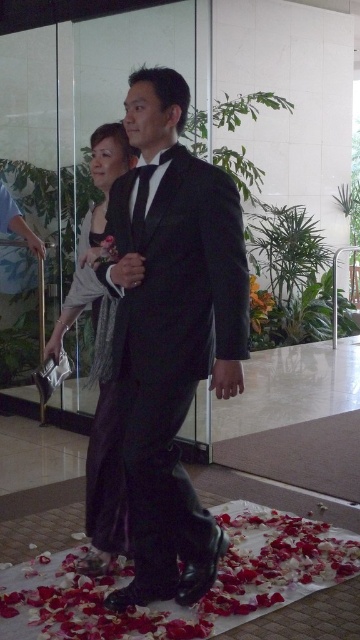
Question: Which is farther from the satin silver dress at center?

Choices:
 (A) satin black dress at center
 (B) black satin suit at center

Answer: (B)

Question: Observing the image, what is the correct spatial positioning of black satin suit at center in reference to orange matte flower at center?

Choices:
 (A) above
 (B) below

Answer: (B)

Question: Which object appears closest to the camera in this image?

Choices:
 (A) satin black dress at center
 (B) orange matte flower at center
 (C) black satin suit at center

Answer: (C)

Question: Which of these objects is positioned farthest from the black satin suit at center?

Choices:
 (A) orange matte flower at center
 (B) satin silver dress at center

Answer: (A)

Question: Can you confirm if black satin suit at center is wider than orange matte flower at center?

Choices:
 (A) yes
 (B) no

Answer: (A)

Question: Can you confirm if black satin suit at center is thinner than satin silver dress at center?

Choices:
 (A) no
 (B) yes

Answer: (A)